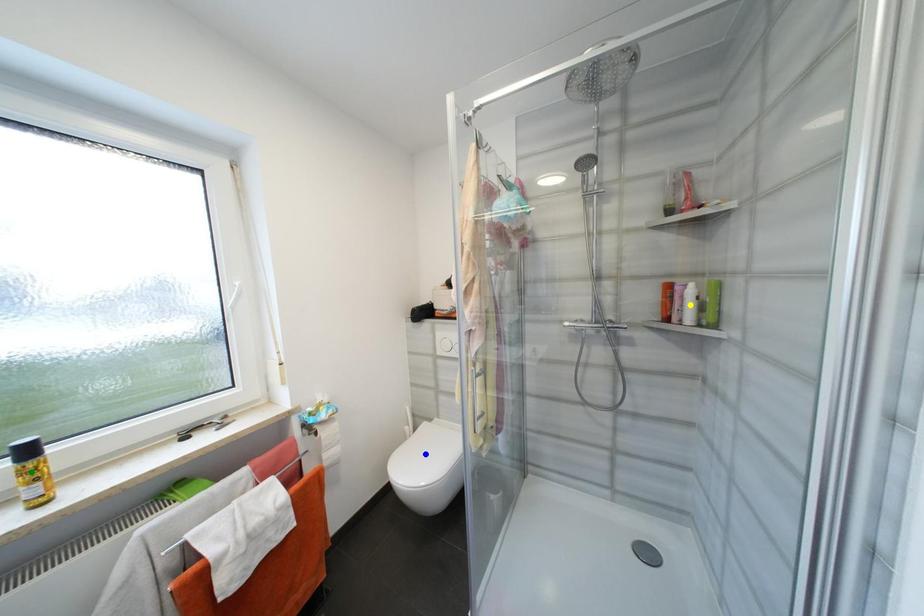
Order these from nearest to farthest:
yellow point | blue point | green point

blue point < yellow point < green point